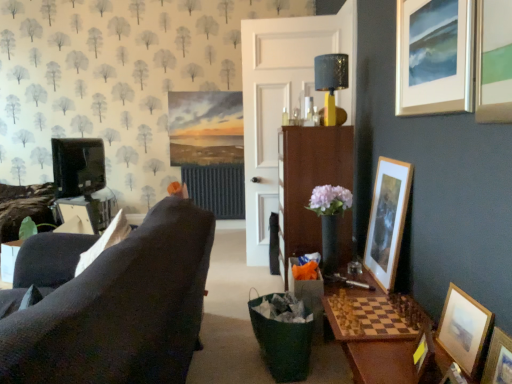
Question: Looking at their shapes, would you say shiny metallic lampshade at upper center is wider or thinner than wooden picture frame at lower right, marked as the 2th picture frame in a bottom-to-top arrangement?

Choices:
 (A) wide
 (B) thin

Answer: (A)

Question: Based on their positions, is shiny metallic lampshade at upper center located to the left or right of wooden picture frame at lower right, marked as the 2th picture frame in a bottom-to-top arrangement?

Choices:
 (A) left
 (B) right

Answer: (A)

Question: Estimate the real-world distances between objects in this image. Which object is farther from the wooden picture frame at lower right, arranged as the 5th picture frame when viewed from the top?

Choices:
 (A) white wooden door at center
 (B) wooden picture frame at lower right, the fourth picture frame when ordered from bottom to top
 (C) silver metallic picture frame at upper right, arranged as the 6th picture frame when ordered from the bottom
 (D) shiny metallic lampshade at upper center
 (E) wooden framed picture at right, which ranks as the second picture frame in top-to-bottom order

Answer: (A)

Question: Which is nearer to the wooden picture frame at lower right, placed as the sixth picture frame when sorted from top to bottom?

Choices:
 (A) white wooden door at center
 (B) brown wood cabinet at center
 (C) silver metallic picture frame at upper right, placed as the 1th picture frame when sorted from top to bottom
 (D) wooden framed picture at right, which ranks as the second picture frame in top-to-bottom order
 (E) wooden picture frame at lower right, the 3th picture frame when ordered from bottom to top

Answer: (E)